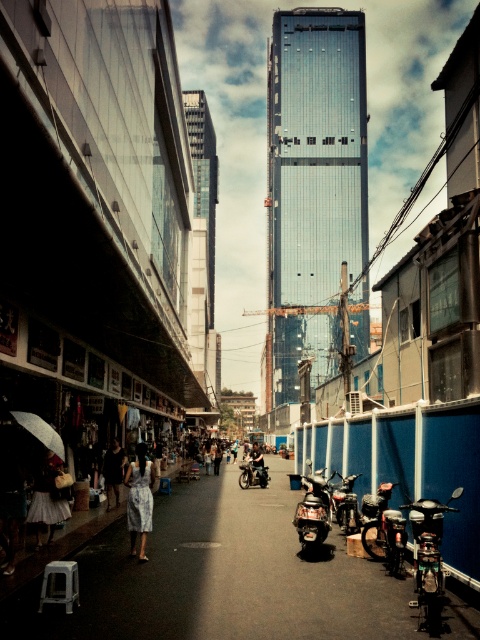
Between matte white umbrella at lower left and white matte umbrella at lower left, which one is positioned lower?

matte white umbrella at lower left is lower down.

Who is more forward, (132, 417) or (46, 436)?

Positioned in front is point (46, 436).

Find the location of a particular element. Image resolution: width=480 pixels, height=640 pixels. matte white umbrella at lower left is located at coordinates (72, 476).

Is matte black scooter at center positioned before printed fabric dress at center?

Yes, it is in front of printed fabric dress at center.

Does matte black scooter at center have a lesser height compared to printed fabric dress at center?

No.

Between point (199, 483) and point (144, 461), which one is positioned behind?

The point (199, 483) is behind.

Find the location of a particular element. The height and width of the screenshot is (640, 480). matte black scooter at center is located at coordinates (222, 577).

Who is lower down, printed fabric dress at center or dark blue leather jacket at center?

dark blue leather jacket at center is lower down.

Between printed fabric dress at center and dark blue leather jacket at center, which one has less height?

printed fabric dress at center is shorter.

Where is `printed fabric dress at center`? The width and height of the screenshot is (480, 640). printed fabric dress at center is located at coordinates (140, 499).